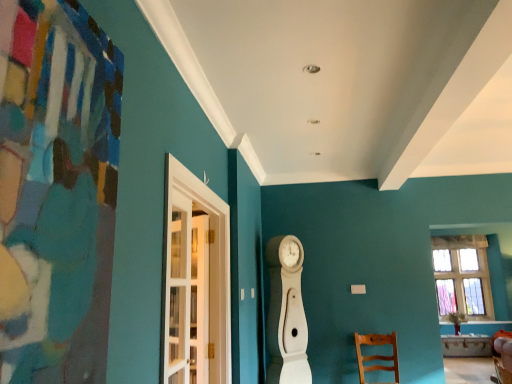
What is the approximate height of wooden chair at lower right?

It is 21.50 inches.

Describe the element at coordinates (195, 280) in the screenshot. The height and width of the screenshot is (384, 512). I see `white glass door at left` at that location.

In the scene shown: Measure the distance between point (x=201, y=185) and camera.

They are 8.22 feet apart.

This screenshot has width=512, height=384. What are the coordinates of `wooden chair at lower right` in the screenshot? It's located at (376, 355).

Which object is more forward, white glass door at left or wooden chair at lower right?

Positioned in front is white glass door at left.

Which is more to the left, white glass door at left or wooden chair at lower right?

white glass door at left is more to the left.

From the picture: From the image's perspective, is white glass door at left above or below wooden chair at lower right?

Based on their image positions, white glass door at left is located above wooden chair at lower right.

From a real-world perspective, is white glass door at left over clear glass window at right?

Yes, from a real-world perspective, white glass door at left is above clear glass window at right.

Can you see white glass door at left touching clear glass window at right?

There is a gap between white glass door at left and clear glass window at right.

You are a GUI agent. You are given a task and a screenshot of the screen. Output one action in this format:
    pyautogui.click(x=<x>, y=<y>)
    Task: Click on the glass door located above the clear glass window at right (from the image's perspective)
    The image size is (512, 384).
    Given the screenshot: What is the action you would take?
    pyautogui.click(x=195, y=280)

Would you say wooden chair at lower right is outside white glass door at left?

Indeed, wooden chair at lower right is completely outside white glass door at left.

Who is taller, wooden chair at lower right or white glass door at left?

white glass door at left.

Looking at this image, measure the distance from wooden chair at lower right to white glass door at left.

wooden chair at lower right is 7.56 feet from white glass door at left.

Does wooden chair at lower right have a lesser height compared to clear glass window at right?

Yes.

Is wooden chair at lower right positioned far away from clear glass window at right?

Yes, wooden chair at lower right is far from clear glass window at right.

Is wooden chair at lower right oriented away from clear glass window at right?

wooden chair at lower right does not have its back to clear glass window at right.

Consider the image. Is the depth of wooden chair at lower right less than that of clear glass window at right?

Yes, wooden chair at lower right is closer to the camera.

You are a GUI agent. You are given a task and a screenshot of the screen. Output one action in this format:
    pyautogui.click(x=<x>, y=<y>)
    Task: Click on the window behind the white glass door at left
    
    Given the screenshot: What is the action you would take?
    tap(462, 276)

In the scene shown: Is clear glass window at right outside of white glass door at left?

Absolutely, clear glass window at right is external to white glass door at left.

Is clear glass window at right touching white glass door at left?

No, clear glass window at right is not making contact with white glass door at left.

Which is more to the left, clear glass window at right or wooden chair at lower right?

wooden chair at lower right.

In the scene shown: Is clear glass window at right shorter than wooden chair at lower right?

In fact, clear glass window at right may be taller than wooden chair at lower right.

From the image's perspective, which is below, clear glass window at right or wooden chair at lower right?

clear glass window at right.

Is point (441, 312) farther from camera compared to point (377, 366)?

That is True.

I want to click on chair beneath the white glass door at left (from a real-world perspective), so click(x=376, y=355).

Identify the location of glass door above the clear glass window at right (from the image's perspective). Image resolution: width=512 pixels, height=384 pixels. (195, 280).

Consider the image. Which object lies nearer to the anchor point clear glass window at right, white glass door at left or wooden chair at lower right?

wooden chair at lower right is positioned closer to the anchor clear glass window at right.

From the image, which object appears to be farther from white glass door at left, clear glass window at right or wooden chair at lower right?

Based on the image, clear glass window at right appears to be further to white glass door at left.

Considering their positions, is clear glass window at right positioned further to wooden chair at lower right than white glass door at left?

white glass door at left is further to wooden chair at lower right.

Which object lies nearer to the anchor point clear glass window at right, wooden chair at lower right or white glass door at left?

Based on the image, wooden chair at lower right appears to be nearer to clear glass window at right.

Which object lies further to the anchor point white glass door at left, wooden chair at lower right or clear glass window at right?

clear glass window at right lies further to white glass door at left than the other object.

From the picture: Considering their positions, is white glass door at left positioned closer to wooden chair at lower right than clear glass window at right?

The object closer to wooden chair at lower right is clear glass window at right.

What are the coordinates of `chair between white glass door at left and clear glass window at right from front to back` in the screenshot? It's located at (376, 355).